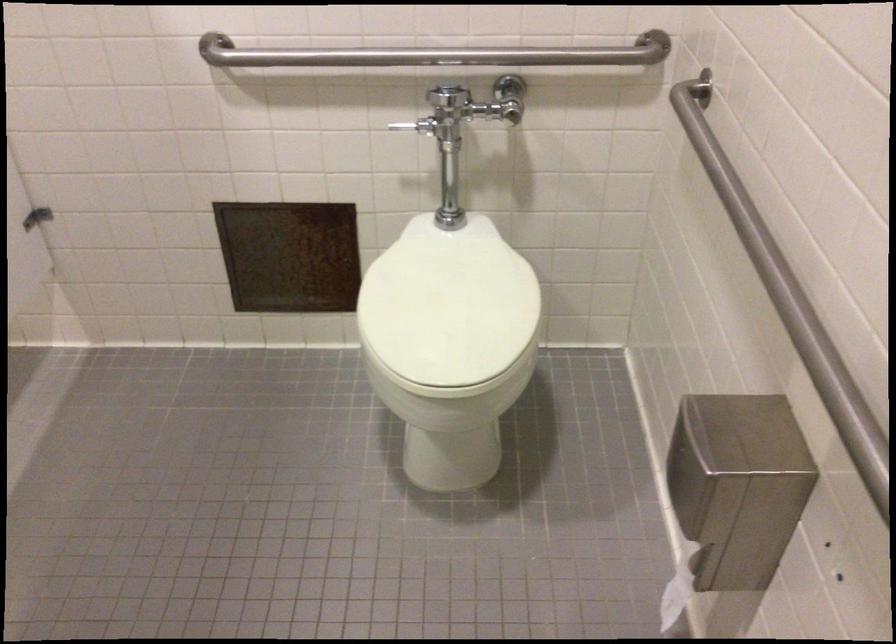
Identify the location of white toilet seat lid. (451, 304).